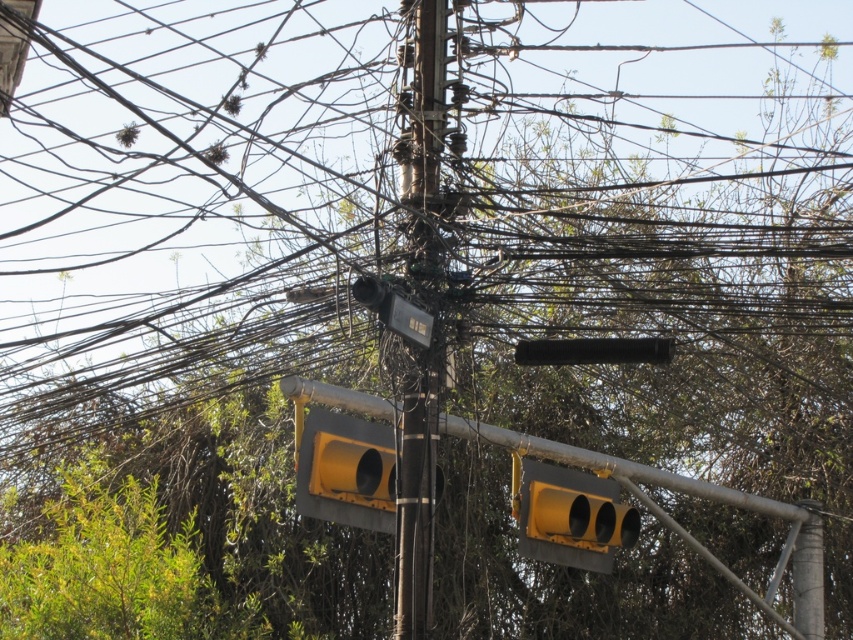
Does metallic pole at center have a greater width compared to yellow matte traffic light at lower center?

No.

Does metallic pole at center have a lesser width compared to yellow matte traffic light at lower center?

Yes.

Where is `metallic pole at center`? The image size is (853, 640). metallic pole at center is located at coordinates (424, 148).